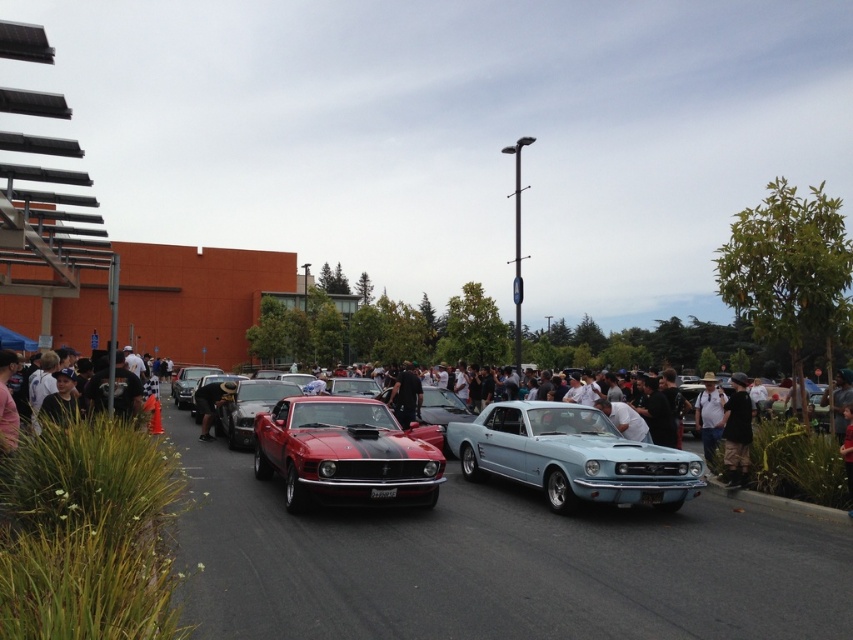
Question: Is light blue metallic car at center to the left of shiny red car at center from the viewer's perspective?

Choices:
 (A) yes
 (B) no

Answer: (B)

Question: Does light blue metallic car at center appear on the right side of shiny red car at center?

Choices:
 (A) yes
 (B) no

Answer: (A)

Question: Which of the following is the closest to the observer?

Choices:
 (A) dark brown leather jacket at center
 (B) shiny red car at center

Answer: (A)

Question: Does light blue metallic car at center come in front of shiny red car at center?

Choices:
 (A) no
 (B) yes

Answer: (B)

Question: Which of the following is the closest to the observer?

Choices:
 (A) shiny red car at center
 (B) shiny red muscle car at center
 (C) shiny black sedan at center

Answer: (B)

Question: Which is farther from the shiny black sedan at center?

Choices:
 (A) dark brown leather jacket at center
 (B) light blue metallic car at center
 (C) shiny red muscle car at center

Answer: (A)